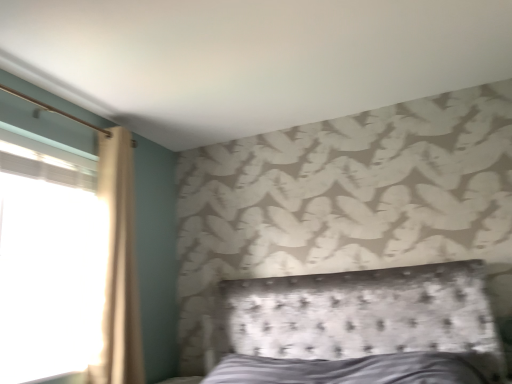
Question: Is beige fabric curtain at left to the left or to the right of transparent glass window at left in the image?

Choices:
 (A) right
 (B) left

Answer: (A)

Question: Considering the positions of beige fabric curtain at left and transparent glass window at left in the image, is beige fabric curtain at left taller or shorter than transparent glass window at left?

Choices:
 (A) tall
 (B) short

Answer: (A)

Question: From a real-world perspective, is beige fabric curtain at left above or below transparent glass window at left?

Choices:
 (A) below
 (B) above

Answer: (B)

Question: Looking at the image, does transparent glass window at left seem bigger or smaller compared to beige fabric curtain at left?

Choices:
 (A) big
 (B) small

Answer: (B)

Question: From a real-world perspective, relative to beige fabric curtain at left, is transparent glass window at left vertically above or below?

Choices:
 (A) above
 (B) below

Answer: (B)

Question: From the image's perspective, is transparent glass window at left positioned above or below beige fabric curtain at left?

Choices:
 (A) above
 (B) below

Answer: (B)

Question: Is point (19, 190) positioned closer to the camera than point (115, 377)?

Choices:
 (A) farther
 (B) closer

Answer: (A)